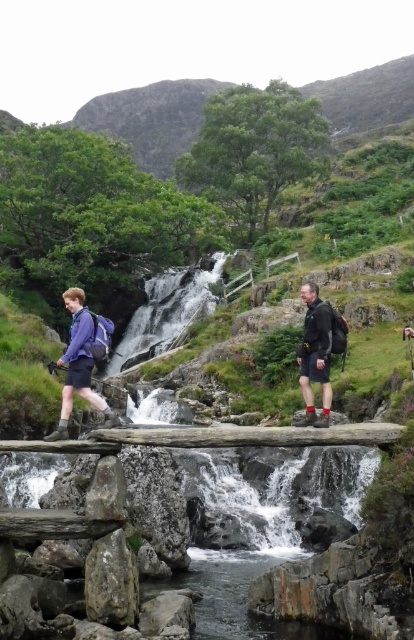
Question: Can you confirm if matte purple jacket at left is wider than matte black backpack at center?

Choices:
 (A) no
 (B) yes

Answer: (B)

Question: Which of the following is the farthest from the observer?

Choices:
 (A) (88, 323)
 (B) (308, 344)

Answer: (B)

Question: Which object is farther from the camera taking this photo?

Choices:
 (A) matte black backpack at center
 (B) matte purple jacket at left

Answer: (A)

Question: In this image, where is matte purple jacket at left located relative to matte black backpack at center?

Choices:
 (A) right
 (B) left

Answer: (B)

Question: Can you confirm if matte purple jacket at left is thinner than matte black backpack at center?

Choices:
 (A) yes
 (B) no

Answer: (B)

Question: Which point appears closest to the camera in this image?

Choices:
 (A) (77, 362)
 (B) (329, 323)

Answer: (A)